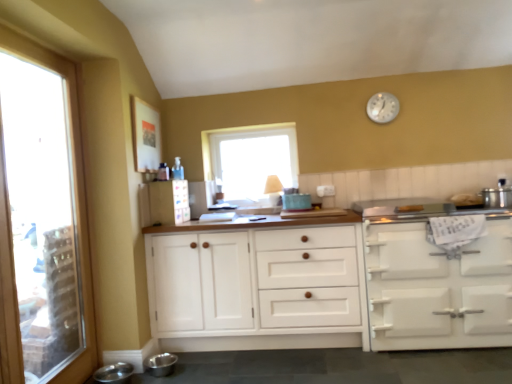
Question: Does point (437, 261) appear closer or farther from the camera than point (500, 188)?

Choices:
 (A) closer
 (B) farther

Answer: (A)

Question: Is white matte oven at right, which ranks as the 1th cabinetry in right-to-left order, inside the boundaries of stainless steel pot at right, the 2th appliance in the back-to-front sequence, or outside?

Choices:
 (A) outside
 (B) inside

Answer: (A)

Question: Estimate the real-world distances between objects in this image. Which object is farther from the white matte oven at right, the second cabinetry positioned from the left?

Choices:
 (A) white wood cabinet at center, marked as the 2th cabinetry in a right-to-left arrangement
 (B) stainless steel bowls at lower left, the 1th appliance from the bottom
 (C) wooden spice rack at center, which ranks as the 2th appliance in right-to-left order
 (D) clear glass window at left, which ranks as the 1th window in left-to-right order
 (E) transparent glass window at center, the first window positioned from the back

Answer: (D)

Question: Based on their relative distances, which object is farther from the white matte oven at right, which ranks as the 1th cabinetry in right-to-left order?

Choices:
 (A) silver metallic clock at upper center
 (B) wooden spice rack at center, the second appliance ordered from the bottom
 (C) clear glass window at left, acting as the 1th window starting from the front
 (D) transparent glass window at center, positioned as the 1th window in right-to-left order
 (E) white wood cabinet at center, the 1th cabinetry when ordered from left to right

Answer: (C)